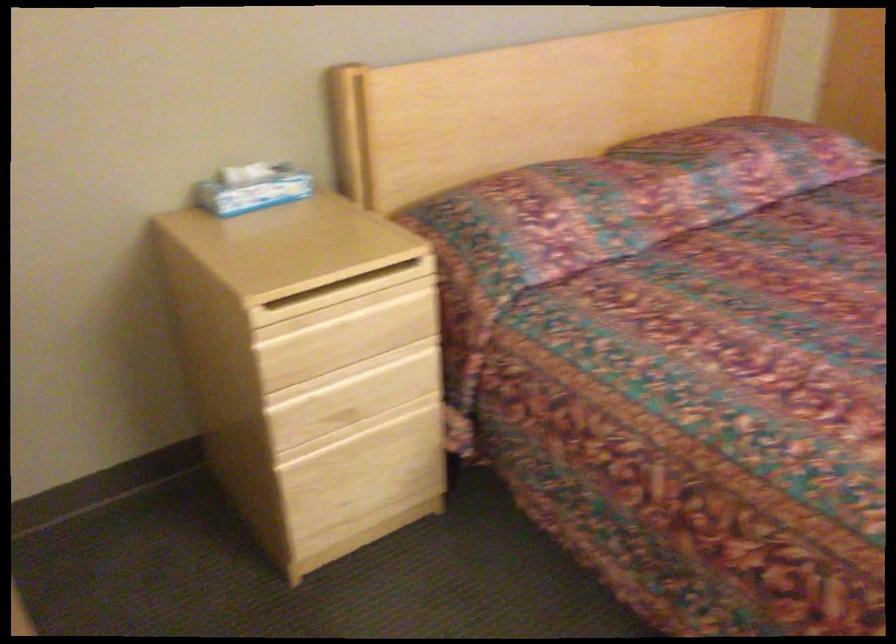
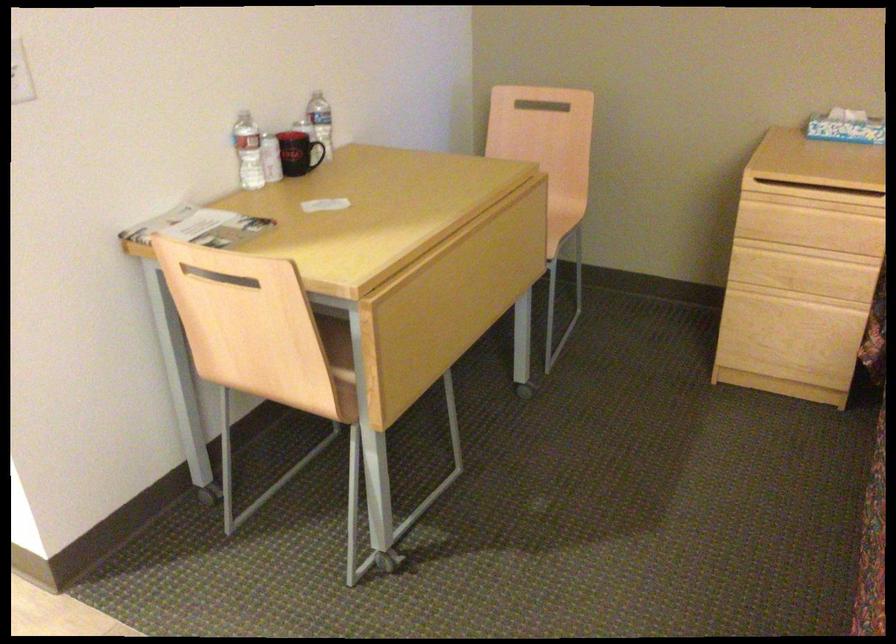
In the second image, find the point that corresponds to (367,448) in the first image.

(790, 313)